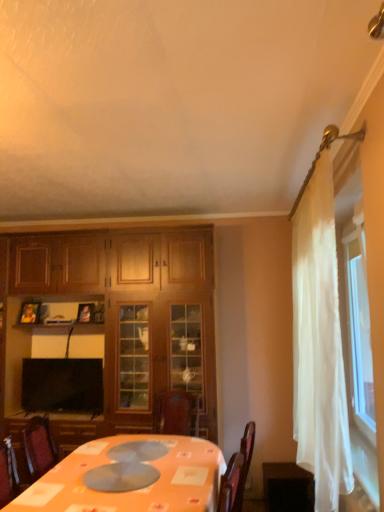
Describe the element at coordinates (30, 312) in the screenshot. The height and width of the screenshot is (512, 384). I see `wooden picture frame at upper left, which ranks as the 1th picture frame in left-to-right order` at that location.

The width and height of the screenshot is (384, 512). Identify the location of wooden cabinet at left. (133, 309).

Locate an element on the screen. Image resolution: width=384 pixels, height=512 pixels. dark wood table at lower right is located at coordinates (287, 488).

What is the approximate height of dark wood table at lower right?

15.39 inches.

Find the location of a particular element. This screenshot has height=512, width=384. orange fabric table at lower center is located at coordinates (131, 477).

Identify the location of matte black picture frame at upper left, the first picture frame in the right-to-left sequence. (86, 313).

What do you see at coordinates (62, 385) in the screenshot?
I see `black glossy tv at lower left` at bounding box center [62, 385].

Measure the distance between black glossy tv at lower left and camera.

black glossy tv at lower left is 3.53 meters away from camera.

The height and width of the screenshot is (512, 384). I want to click on white sheer curtain at right, so click(x=319, y=344).

The width and height of the screenshot is (384, 512). Identify the location of wooden picture frame at upper left, which is the second picture frame in right-to-left order. (30, 312).

Can you tell me how much orange fabric table at lower center and dark wood table at lower right differ in facing direction?

0.14 degrees separate the facing orientations of orange fabric table at lower center and dark wood table at lower right.

Is the position of orange fabric table at lower center less distant than that of dark wood table at lower right?

Yes, the depth of orange fabric table at lower center is less than that of dark wood table at lower right.

From a real-world perspective, is orange fabric table at lower center below dark wood table at lower right?

No, from a real-world perspective, orange fabric table at lower center is not under dark wood table at lower right.

Could you tell me if orange fabric table at lower center is turned towards dark wood table at lower right?

No, orange fabric table at lower center is not facing towards dark wood table at lower right.

Can you tell me how much black glossy tv at lower left and matte black picture frame at upper left, the 2th picture frame viewed from the left, differ in facing direction?

1.16 degrees separate the facing orientations of black glossy tv at lower left and matte black picture frame at upper left, the 2th picture frame viewed from the left.

From the image's perspective, would you say black glossy tv at lower left is shown under matte black picture frame at upper left, the first picture frame in the right-to-left sequence?

Indeed, from the image's perspective, black glossy tv at lower left is shown beneath matte black picture frame at upper left, the first picture frame in the right-to-left sequence.

Which object is further away from the camera, black glossy tv at lower left or matte black picture frame at upper left, the 2th picture frame viewed from the left?

matte black picture frame at upper left, the 2th picture frame viewed from the left, is more distant.

Does black glossy tv at lower left have a smaller size compared to matte black picture frame at upper left, the 2th picture frame viewed from the left?

No, black glossy tv at lower left is not smaller than matte black picture frame at upper left, the 2th picture frame viewed from the left.

Which object is wider, matte black picture frame at upper left, the first picture frame in the right-to-left sequence, or orange fabric table at lower center?

Wider between the two is orange fabric table at lower center.

Does point (78, 313) come closer to viewer compared to point (208, 445)?

No, it is behind (208, 445).

Identify the location of picture frame that is the 1st object to the left of the orange fabric table at lower center, starting at the anchor. (86, 313).

Is matte black picture frame at upper left, the first picture frame in the right-to-left sequence, shorter than orange fabric table at lower center?

Correct, matte black picture frame at upper left, the first picture frame in the right-to-left sequence, is not as tall as orange fabric table at lower center.

Considering the relative sizes of wooden cabinet at left and orange fabric table at lower center in the image provided, is wooden cabinet at left thinner than orange fabric table at lower center?

Correct, the width of wooden cabinet at left is less than that of orange fabric table at lower center.

Considering the relative sizes of wooden cabinet at left and orange fabric table at lower center in the image provided, is wooden cabinet at left bigger than orange fabric table at lower center?

Yes, wooden cabinet at left is bigger than orange fabric table at lower center.

From the image's perspective, is wooden cabinet at left located beneath orange fabric table at lower center?

No, from the image's perspective, wooden cabinet at left is not beneath orange fabric table at lower center.

Visually, is wooden cabinet at left positioned to the left or to the right of orange fabric table at lower center?

Clearly, wooden cabinet at left is on the left of orange fabric table at lower center in the image.

Is wooden picture frame at upper left, which is the second picture frame in right-to-left order, shorter than dark wood table at lower right?

Indeed, wooden picture frame at upper left, which is the second picture frame in right-to-left order, has a lesser height compared to dark wood table at lower right.

Is wooden picture frame at upper left, which is the second picture frame in right-to-left order, to the left or to the right of dark wood table at lower right in the image?

In the image, wooden picture frame at upper left, which is the second picture frame in right-to-left order, appears on the left side of dark wood table at lower right.

Is wooden picture frame at upper left, which is the second picture frame in right-to-left order, next to dark wood table at lower right?

wooden picture frame at upper left, which is the second picture frame in right-to-left order, and dark wood table at lower right are clearly separated.

Is point (38, 315) in front of point (305, 507)?

No, it is not.

Would you say white sheer curtain at right is a long distance from matte black picture frame at upper left, the first picture frame in the right-to-left sequence?

Indeed, white sheer curtain at right is not near matte black picture frame at upper left, the first picture frame in the right-to-left sequence.

Is white sheer curtain at right oriented away from matte black picture frame at upper left, the 2th picture frame viewed from the left?

No, white sheer curtain at right's orientation is not away from matte black picture frame at upper left, the 2th picture frame viewed from the left.

Is the position of white sheer curtain at right less distant than that of matte black picture frame at upper left, the first picture frame in the right-to-left sequence?

Yes.

Is point (313, 277) closer to camera compared to point (78, 320)?

Yes, it is.

Is the depth of dark wood table at lower right less than that of orange fabric table at lower center?

No, it is not.

Is dark wood table at lower right directly adjacent to orange fabric table at lower center?

No, dark wood table at lower right is not with orange fabric table at lower center.

Who is shorter, dark wood table at lower right or orange fabric table at lower center?

With less height is dark wood table at lower right.

Looking at their sizes, would you say dark wood table at lower right is wider or thinner than orange fabric table at lower center?

Considering their sizes, dark wood table at lower right looks slimmer than orange fabric table at lower center.

At what (x,y) coordinates should I click in order to perform the action: click on desk that appears on the left of dark wood table at lower right. Please return your answer as a coordinate pair (x, y). Looking at the image, I should click on (131, 477).

What are the coordinates of `television that is in front of the matte black picture frame at upper left, the first picture frame in the right-to-left sequence` in the screenshot? It's located at pos(62,385).

Looking at the image, which one is located further to wooden picture frame at upper left, which ranks as the 1th picture frame in left-to-right order, black glossy tv at lower left or orange fabric table at lower center?

Among the two, orange fabric table at lower center is located further to wooden picture frame at upper left, which ranks as the 1th picture frame in left-to-right order.

Looking at this image, considering their positions, is wooden cabinet at left positioned closer to wooden picture frame at upper left, which ranks as the 1th picture frame in left-to-right order, than orange fabric table at lower center?

The object closer to wooden picture frame at upper left, which ranks as the 1th picture frame in left-to-right order, is wooden cabinet at left.

Based on their spatial positions, is dark wood table at lower right or black glossy tv at lower left further from white sheer curtain at right?

Among the two, black glossy tv at lower left is located further to white sheer curtain at right.

Estimate the real-world distances between objects in this image. Which object is closer to dark wood table at lower right, matte black picture frame at upper left, the first picture frame in the right-to-left sequence, or wooden picture frame at upper left, which ranks as the 1th picture frame in left-to-right order?

matte black picture frame at upper left, the first picture frame in the right-to-left sequence, is positioned closer to the anchor dark wood table at lower right.

Based on their spatial positions, is wooden cabinet at left or white sheer curtain at right further from black glossy tv at lower left?

Among the two, white sheer curtain at right is located further to black glossy tv at lower left.

Estimate the real-world distances between objects in this image. Which object is closer to orange fabric table at lower center, white sheer curtain at right or black glossy tv at lower left?

The object closer to orange fabric table at lower center is white sheer curtain at right.

Consider the image. From the image, which object appears to be nearer to orange fabric table at lower center, wooden picture frame at upper left, which ranks as the 1th picture frame in left-to-right order, or wooden cabinet at left?

Based on the image, wooden cabinet at left appears to be nearer to orange fabric table at lower center.

When comparing their distances from white sheer curtain at right, does orange fabric table at lower center or matte black picture frame at upper left, the 2th picture frame viewed from the left, seem further?

Based on the image, matte black picture frame at upper left, the 2th picture frame viewed from the left, appears to be further to white sheer curtain at right.

Locate an element on the screen. picture frame between matte black picture frame at upper left, the 2th picture frame viewed from the left, and black glossy tv at lower left, in the vertical direction is located at coordinates (30, 312).

What are the coordinates of `television between white sheer curtain at right and matte black picture frame at upper left, the 2th picture frame viewed from the left, from front to back` in the screenshot? It's located at (62, 385).

Identify the location of table between white sheer curtain at right and matte black picture frame at upper left, the first picture frame in the right-to-left sequence, from front to back. The image size is (384, 512). (287, 488).

Where is `television located between wooden picture frame at upper left, which is the second picture frame in right-to-left order, and wooden cabinet at left in the left-right direction`? television located between wooden picture frame at upper left, which is the second picture frame in right-to-left order, and wooden cabinet at left in the left-right direction is located at coordinates tap(62, 385).